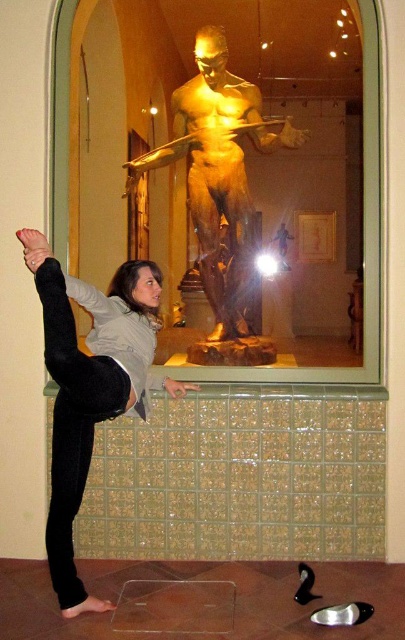
Identify the location of matte black leggings at lower left. This screenshot has height=640, width=405. (81, 396).

Can you confirm if matte black leggings at lower left is positioned to the left of gold polished statue at center?

Indeed, matte black leggings at lower left is positioned on the left side of gold polished statue at center.

Does point (59, 472) lie in front of point (170, 148)?

Yes.

Find the location of a particular element. Image resolution: width=405 pixels, height=640 pixels. matte black leggings at lower left is located at coordinates (81, 396).